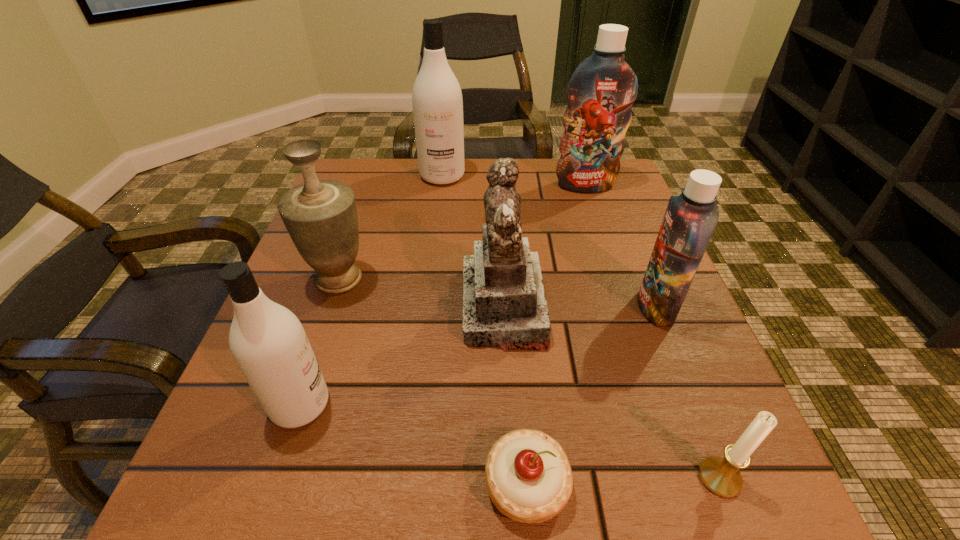
Identify the location of vacant space that satisfies the following two spatial constraints: 1. on the front-facing side of the smaller white shampoo; 2. on the left side of the pastry. This screenshot has height=540, width=960. (274, 484).

This screenshot has height=540, width=960. I want to click on blank area in the image that satisfies the following two spatial constraints: 1. on the front-facing side of the figurine; 2. on the left side of the shortest object, so click(x=514, y=484).

Find the location of a particular element. vacant position in the image that satisfies the following two spatial constraints: 1. on the front-facing side of the figurine; 2. on the left side of the candle holder is located at coordinates (514, 478).